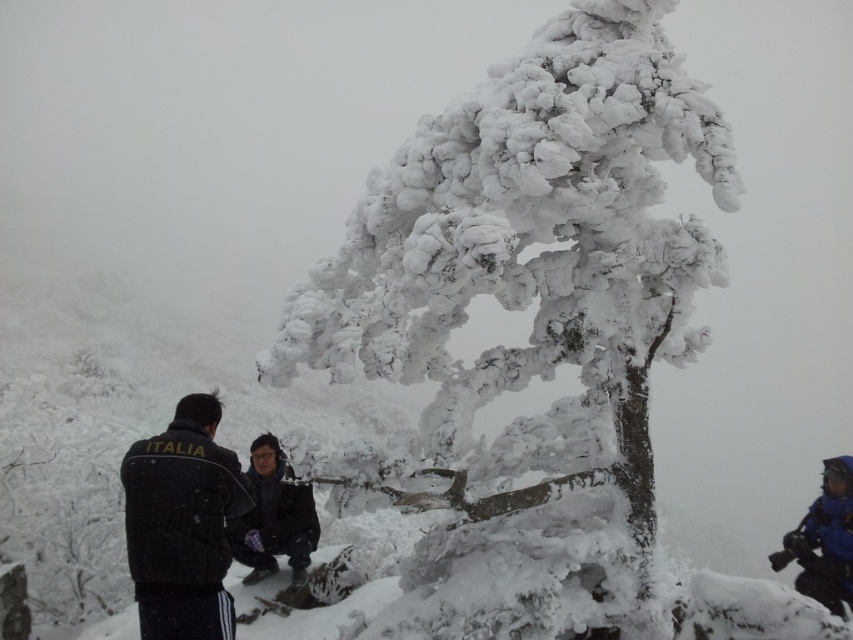
Can you confirm if white frosty tree at center is positioned to the left of blue waterproof jacket at lower right?

Yes, white frosty tree at center is to the left of blue waterproof jacket at lower right.

Measure the distance from white frosty tree at center to blue waterproof jacket at lower right.

The distance of white frosty tree at center from blue waterproof jacket at lower right is 15.98 feet.

Find the location of a particular element. white frosty tree at center is located at coordinates (531, 323).

Image resolution: width=853 pixels, height=640 pixels. In order to click on white frosty tree at center in this screenshot , I will do `click(531, 323)`.

Which is more to the right, black fabric jacket at left or dark gray fabric jacket at center?

dark gray fabric jacket at center

Measure the distance between black fabric jacket at left and camera.

black fabric jacket at left and camera are 4.99 meters apart.

Locate an element on the screen. Image resolution: width=853 pixels, height=640 pixels. black fabric jacket at left is located at coordinates (183, 524).

Is dark gray fabric jacket at center behind blue waterproof jacket at lower right?

That is False.

Is point (242, 582) closer to viewer compared to point (839, 516)?

Yes, point (242, 582) is in front of point (839, 516).

Is point (286, 483) in front of point (834, 484)?

Yes.

I want to click on dark gray fabric jacket at center, so click(273, 516).